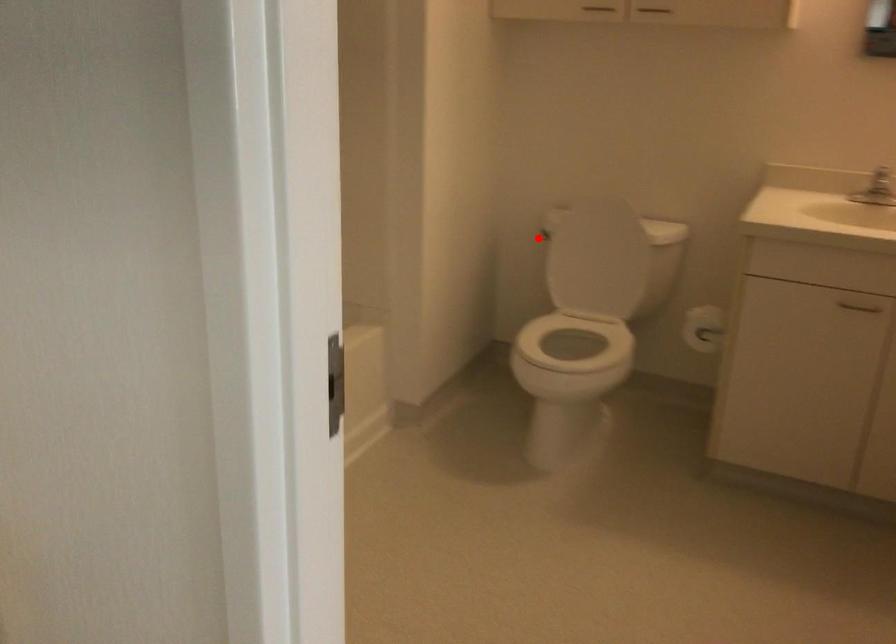
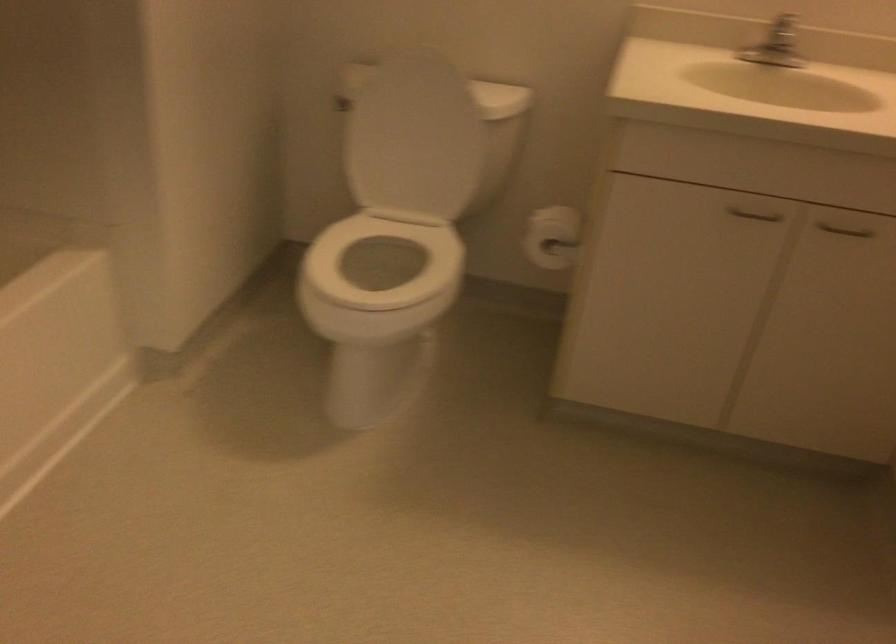
Question: I am providing you with two images of the same scene from different viewpoints. Image1 has a red point marked. In image2, the corresponding 3D location appears at what relative position? Reply with the corresponding letter.

Choices:
 (A) Closer
 (B) Farther

Answer: (A)